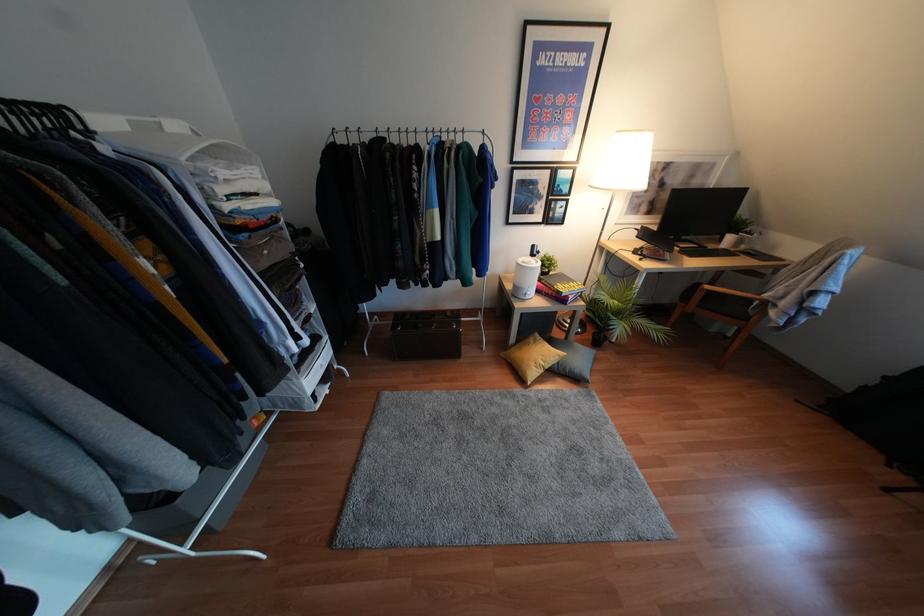
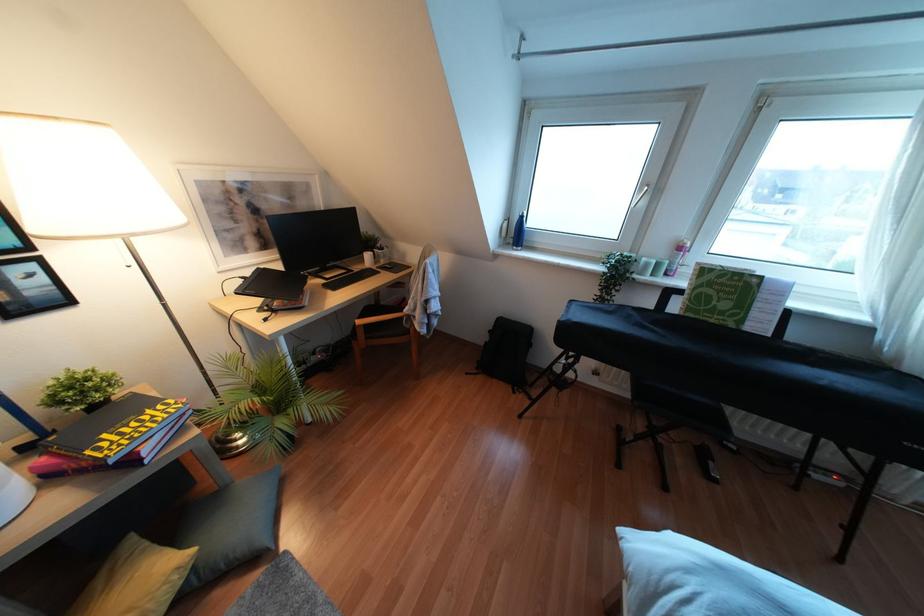
Question: The camera is either moving clockwise (left) or counter-clockwise (right) around the object. The first image is from the beginning of the video and the second image is from the end. Is the camera moving left or right when shooting the video?

Choices:
 (A) Left
 (B) Right

Answer: (A)